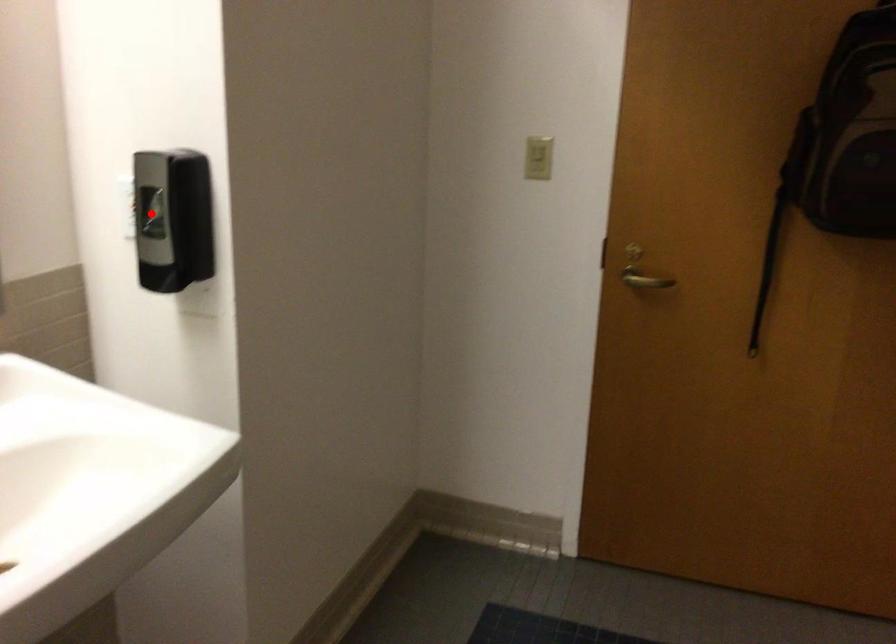
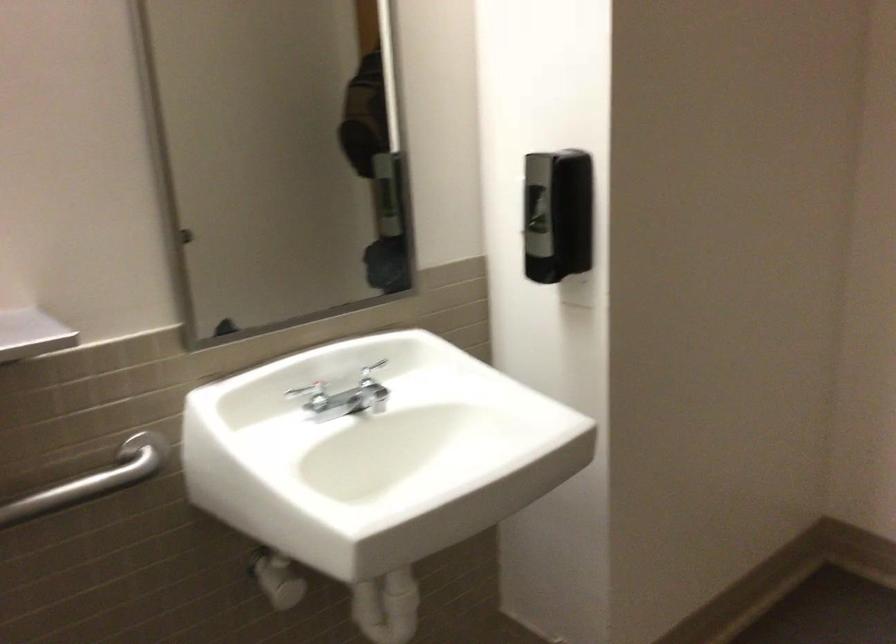
Where in the second image is the point corresponding to the highlighted location from the first image?

(536, 207)